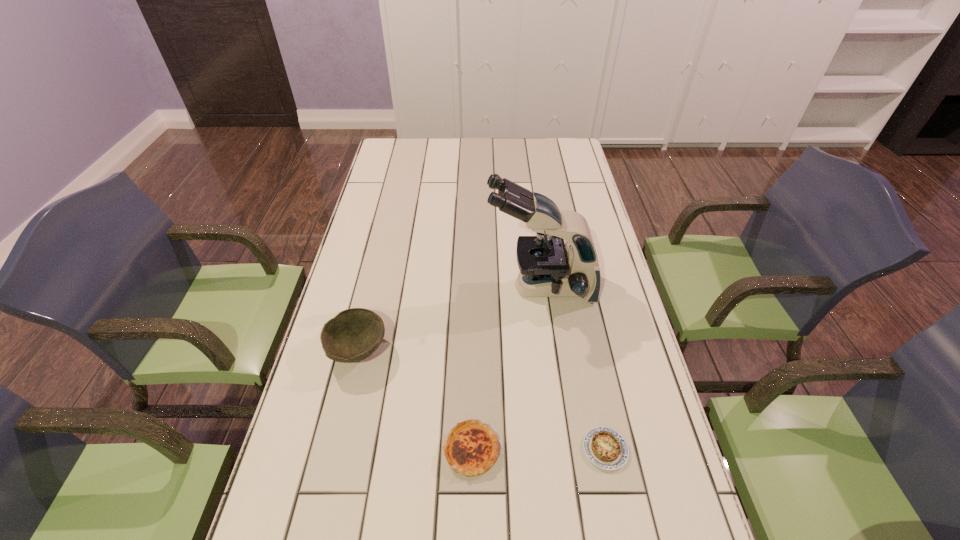
The width and height of the screenshot is (960, 540). Identify the location of free point located 0.130m through the eyepieces of the tallest object. tap(444, 287).

Find the location of a particular element. vacant space located on the front of the bowl is located at coordinates (342, 413).

The height and width of the screenshot is (540, 960). In order to click on vacant space located on the back of the taller quiche in this screenshot , I will do `click(473, 312)`.

Image resolution: width=960 pixels, height=540 pixels. I want to click on blank space located 0.050m on the back of the right quiche, so click(x=597, y=409).

At what (x,y) coordinates should I click in order to perform the action: click on object that is at the left edge. Please return your answer as a coordinate pair (x, y). The height and width of the screenshot is (540, 960). Looking at the image, I should click on (353, 334).

At what (x,y) coordinates should I click in order to perform the action: click on microscope located in the right edge section of the desktop. Please return your answer as a coordinate pair (x, y). The height and width of the screenshot is (540, 960). Looking at the image, I should click on (548, 268).

You are a GUI agent. You are given a task and a screenshot of the screen. Output one action in this format:
    pyautogui.click(x=<x>, y=<y>)
    Task: Click on the quiche that is positioned at the right edge
    The image size is (960, 540).
    Given the screenshot: What is the action you would take?
    pyautogui.click(x=606, y=448)

Locate an element on the screen. The image size is (960, 540). vacant area at the far edge is located at coordinates (503, 147).

In the image, there is a desktop. Find the location of `free space at the left edge`. free space at the left edge is located at coordinates (396, 219).

This screenshot has height=540, width=960. In the image, there is a desktop. In order to click on vacant space at the right edge in this screenshot , I will do `click(612, 266)`.